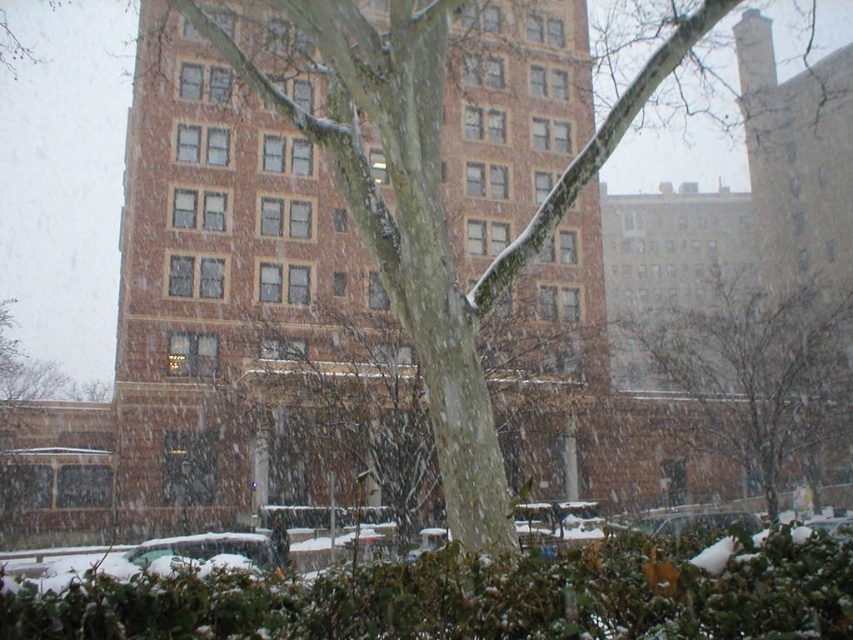
Question: Does smooth bark tree at center come in front of metallic silver car at lower left?

Choices:
 (A) yes
 (B) no

Answer: (B)

Question: Does green leafy bush at lower center have a greater width compared to smooth bark tree at center?

Choices:
 (A) yes
 (B) no

Answer: (B)

Question: Which point appears farthest from the camera in this image?

Choices:
 (A) (349, 579)
 (B) (801, 372)

Answer: (B)

Question: Can you confirm if green leafy bush at lower center is positioned below metallic silver car at lower left?

Choices:
 (A) no
 (B) yes

Answer: (A)

Question: Which object appears closest to the camera in this image?

Choices:
 (A) green leafy bush at lower center
 (B) smooth bark tree at center
 (C) metallic silver car at lower left

Answer: (A)

Question: Based on their relative distances, which object is farther from the metallic silver car at lower left?

Choices:
 (A) smooth bark tree at center
 (B) green leafy bush at lower center

Answer: (A)